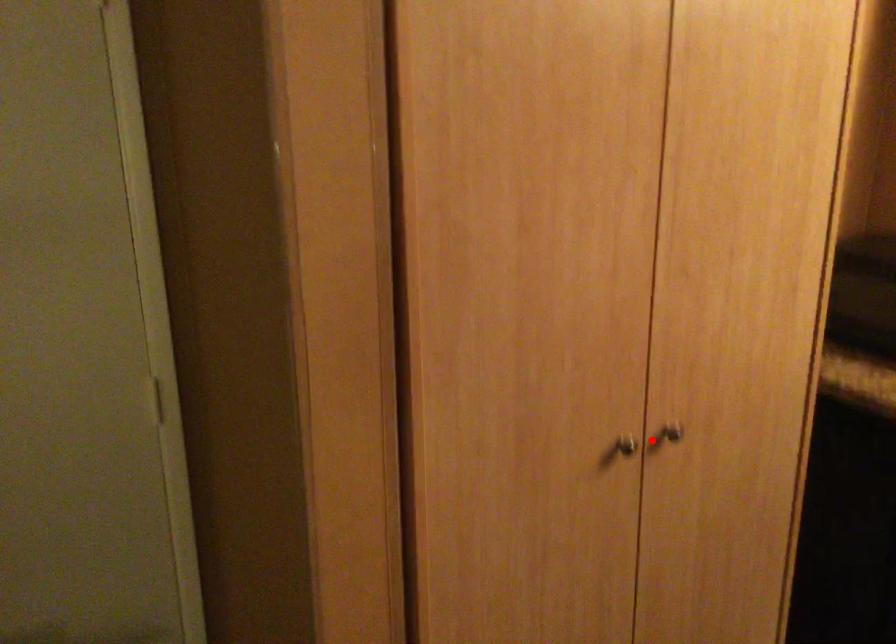
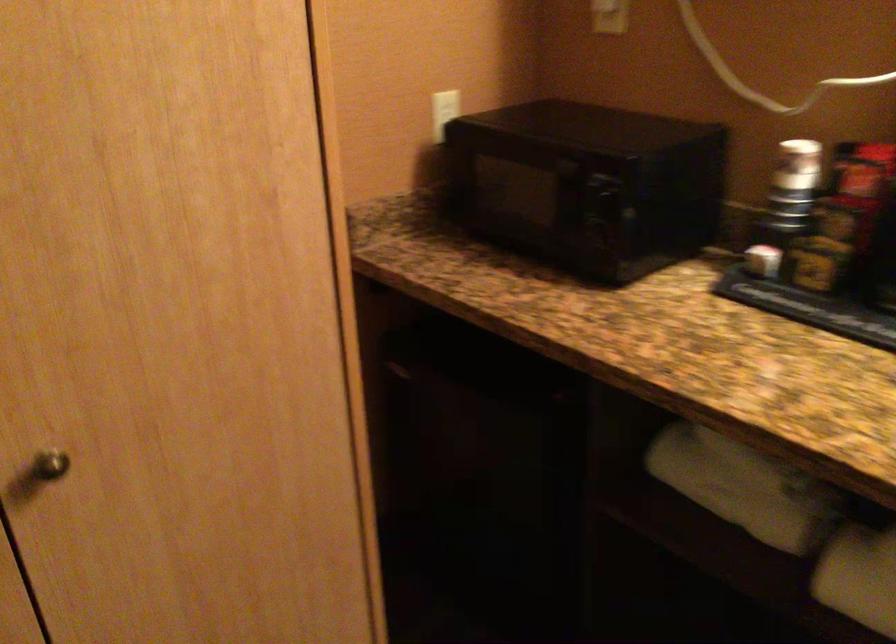
Question: I am providing you with two images of the same scene from different viewpoints. Given a red point in image1, look at the same physical point in image2. Is it:

Choices:
 (A) Closer to the viewpoint
 (B) Farther from the viewpoint

Answer: (A)